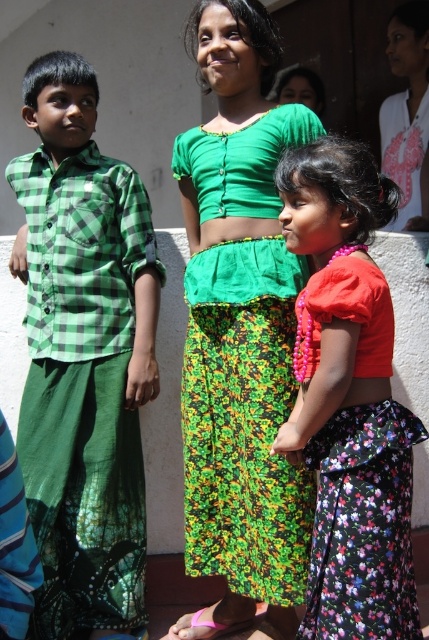
Question: Does floral satin skirt at center have a greater width compared to white cotton shirt at upper right?

Choices:
 (A) yes
 (B) no

Answer: (A)

Question: Can you confirm if green woven skirt at center is positioned below white cotton shirt at upper right?

Choices:
 (A) yes
 (B) no

Answer: (A)

Question: Which object is farther from the camera taking this photo?

Choices:
 (A) green woven skirt at center
 (B) green checkered shirt at left
 (C) white cotton shirt at upper right
 (D) floral satin skirt at center

Answer: (C)

Question: Estimate the real-world distances between objects in this image. Which object is closer to the green woven skirt at center?

Choices:
 (A) white cotton shirt at upper right
 (B) green checkered shirt at left
 (C) floral satin skirt at center

Answer: (C)

Question: Does green woven skirt at center appear over white cotton shirt at upper right?

Choices:
 (A) yes
 (B) no

Answer: (B)

Question: Which object is the farthest from the white cotton shirt at upper right?

Choices:
 (A) floral satin skirt at center
 (B) green checkered shirt at left
 (C) green woven skirt at center

Answer: (B)